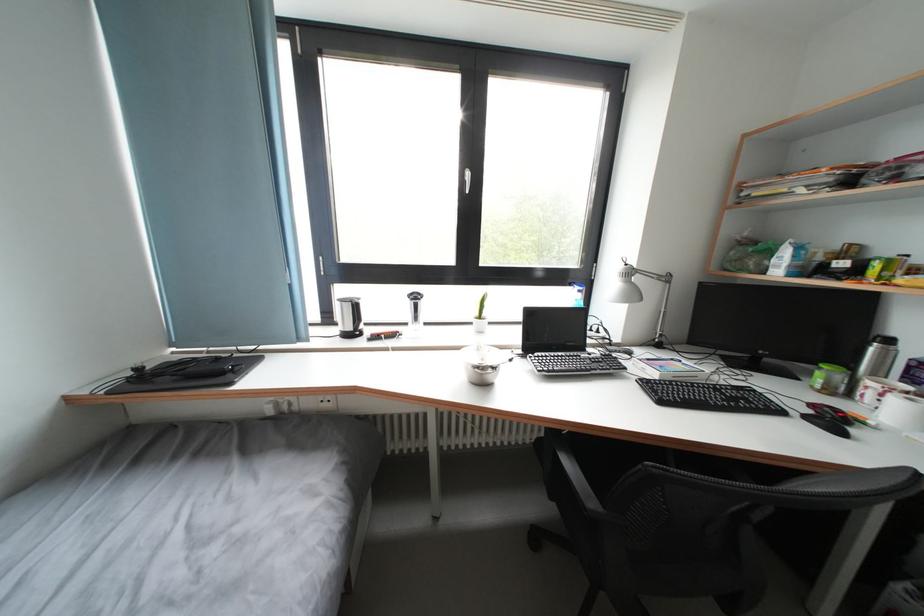
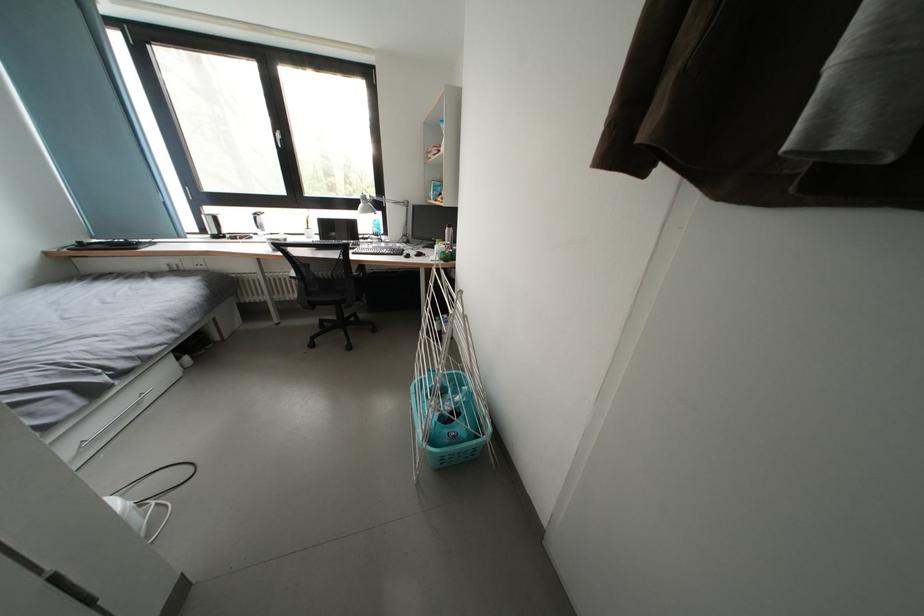
The images are taken continuously from a first-person perspective. In which direction are you moving?

The movement direction of the cameraman is right, backward.